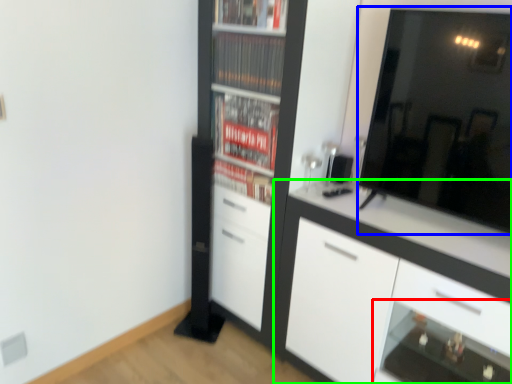
Question: Which object is the farthest from shelf (highlighted by a red box)? Choose among these: mirror (highlighted by a blue box) or cabinetry (highlighted by a green box).

Choices:
 (A) mirror
 (B) cabinetry

Answer: (A)